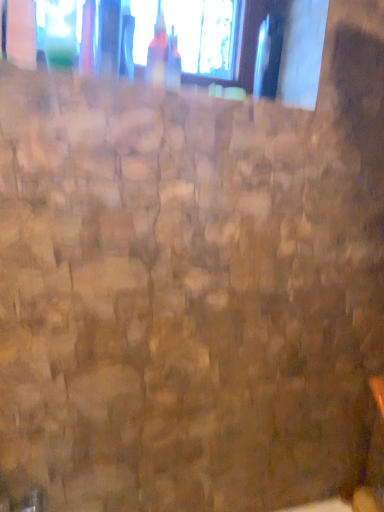
Where is `translucent glass bottle at upper center`? The image size is (384, 512). translucent glass bottle at upper center is located at coordinates (158, 53).

What is the approximate height of translucent glass bottle at upper center?

7.49 inches.

What do you see at coordinates (158, 53) in the screenshot? The image size is (384, 512). I see `translucent glass bottle at upper center` at bounding box center [158, 53].

What do you see at coordinates (207, 36) in the screenshot? The height and width of the screenshot is (512, 384). I see `transparent glass window at upper center` at bounding box center [207, 36].

Image resolution: width=384 pixels, height=512 pixels. What are the coordinates of `transparent glass window at upper center` in the screenshot? It's located at (207, 36).

Where is `translucent glass bottle at upper center`? translucent glass bottle at upper center is located at coordinates (158, 53).

Is translucent glass bottle at upper center at the right side of transparent glass window at upper center?

No.

Which is in front, translucent glass bottle at upper center or transparent glass window at upper center?

Positioned in front is translucent glass bottle at upper center.

Which point is more forward, (157, 49) or (222, 46)?

The point (157, 49) is more forward.

In the scene shown: From the image's perspective, between translucent glass bottle at upper center and transparent glass window at upper center, who is located below?

translucent glass bottle at upper center appears lower in the image.

From a real-world perspective, relative to transparent glass window at upper center, is translucent glass bottle at upper center vertically above or below?

From a real-world perspective, translucent glass bottle at upper center is physically below transparent glass window at upper center.

Considering the relative sizes of translucent glass bottle at upper center and transparent glass window at upper center in the image provided, is translucent glass bottle at upper center wider than transparent glass window at upper center?

Yes.

Considering the sizes of objects translucent glass bottle at upper center and transparent glass window at upper center in the image provided, who is taller, translucent glass bottle at upper center or transparent glass window at upper center?

transparent glass window at upper center is taller.

From the picture: Considering the sizes of translucent glass bottle at upper center and transparent glass window at upper center in the image, is translucent glass bottle at upper center bigger or smaller than transparent glass window at upper center?

translucent glass bottle at upper center is smaller than transparent glass window at upper center.

Which is correct: translucent glass bottle at upper center is inside transparent glass window at upper center, or outside of it?

translucent glass bottle at upper center cannot be found inside transparent glass window at upper center.

Are translucent glass bottle at upper center and transparent glass window at upper center located far from each other?

translucent glass bottle at upper center is near transparent glass window at upper center, not far away.

Is translucent glass bottle at upper center turned away from transparent glass window at upper center?

Absolutely, translucent glass bottle at upper center is directed away from transparent glass window at upper center.

How much distance is there between translucent glass bottle at upper center and transparent glass window at upper center?

5.63 inches.

You are a GUI agent. You are given a task and a screenshot of the screen. Output one action in this format:
    pyautogui.click(x=<x>, y=<y>)
    Task: Click on the bottle in front of the transparent glass window at upper center
    The width and height of the screenshot is (384, 512).
    Given the screenshot: What is the action you would take?
    pyautogui.click(x=158, y=53)

From the picture: Considering the positions of objects transparent glass window at upper center and translucent glass bottle at upper center in the image provided, who is more to the right, transparent glass window at upper center or translucent glass bottle at upper center?

Positioned to the right is transparent glass window at upper center.

Is transparent glass window at upper center in front of or behind translucent glass bottle at upper center in the image?

transparent glass window at upper center is positioned farther from the viewer than translucent glass bottle at upper center.

Which is in front, point (215, 0) or point (159, 38)?

The point (159, 38) is closer.

From the image's perspective, would you say transparent glass window at upper center is shown under translucent glass bottle at upper center?

Incorrect, from the image's perspective, transparent glass window at upper center is higher than translucent glass bottle at upper center.

From a real-world perspective, does transparent glass window at upper center sit lower than translucent glass bottle at upper center?

Actually, transparent glass window at upper center is physically above translucent glass bottle at upper center in the real world.

Consider the image. Does transparent glass window at upper center have a lesser width compared to translucent glass bottle at upper center?

Yes, transparent glass window at upper center is thinner than translucent glass bottle at upper center.

In terms of height, does transparent glass window at upper center look taller or shorter compared to translucent glass bottle at upper center?

In the image, transparent glass window at upper center appears to be taller than translucent glass bottle at upper center.

Looking at the image, does transparent glass window at upper center seem bigger or smaller compared to translucent glass bottle at upper center?

In the image, transparent glass window at upper center appears to be larger than translucent glass bottle at upper center.

Is transparent glass window at upper center inside or outside of translucent glass bottle at upper center?

transparent glass window at upper center cannot be found inside translucent glass bottle at upper center.

Are transparent glass window at upper center and translucent glass bottle at upper center making contact?

No, transparent glass window at upper center is not touching translucent glass bottle at upper center.

Is transparent glass window at upper center positioned with its back to translucent glass bottle at upper center?

No, translucent glass bottle at upper center is not at the back of transparent glass window at upper center.

How many degrees apart are the facing directions of transparent glass window at upper center and translucent glass bottle at upper center?

0.0816 degrees separate the facing orientations of transparent glass window at upper center and translucent glass bottle at upper center.

Measure the distance between transparent glass window at upper center and translucent glass bottle at upper center.

transparent glass window at upper center is 5.63 inches from translucent glass bottle at upper center.

Locate an element on the screen. This screenshot has width=384, height=512. bottle that is in front of the transparent glass window at upper center is located at coordinates (158, 53).

The width and height of the screenshot is (384, 512). Find the location of `window above the translucent glass bottle at upper center (from a real-world perspective)`. window above the translucent glass bottle at upper center (from a real-world perspective) is located at coordinates (207, 36).

Find the location of a particular element. window on the right of translucent glass bottle at upper center is located at coordinates (207, 36).